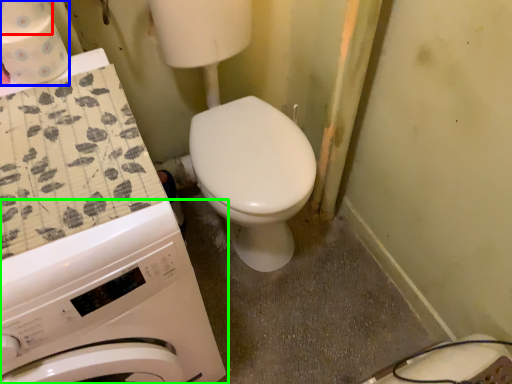
Question: Estimate the real-world distances between objects in this image. Which object is farther from toilet paper (highlighted by a red box), toilet paper (highlighted by a blue box) or washing machine (highlighted by a green box)?

Choices:
 (A) toilet paper
 (B) washing machine

Answer: (B)